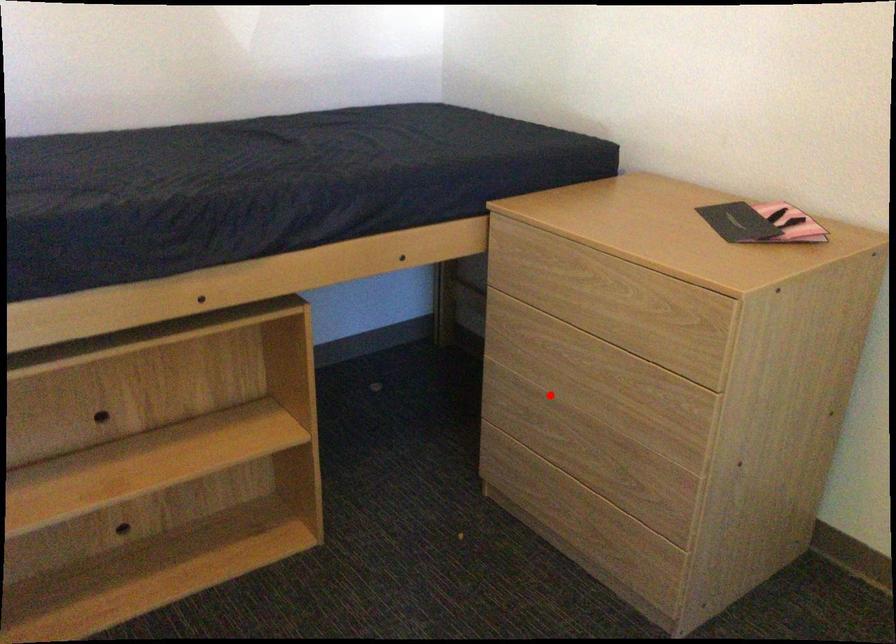
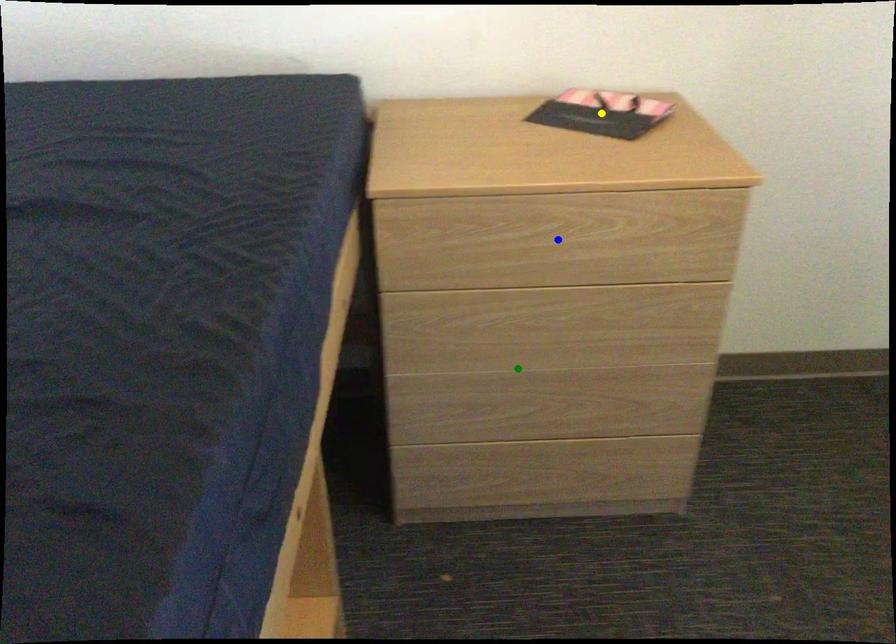
Question: I am providing you with two images of the same scene from different viewpoints. A red point is marked on the first image. You are given multiple points on the second image. Which point in image 2 represents the same 3d spot as the red point in image 1?

Choices:
 (A) green point
 (B) blue point
 (C) yellow point

Answer: (A)